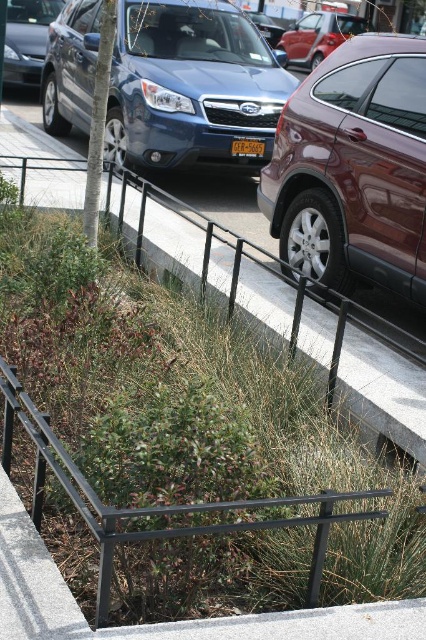
Is point (170, 17) positioned behind point (28, 81)?

That is False.

This screenshot has width=426, height=640. Identify the location of matte blue car at center. (192, 86).

What are the coordinates of `matte blue car at center` in the screenshot? It's located at (192, 86).

Can you confirm if shiny maroon suv at center is shorter than shiny metallic sedan at upper left?

Correct, shiny maroon suv at center is not as tall as shiny metallic sedan at upper left.

Who is higher up, shiny maroon suv at center or shiny metallic sedan at upper left?

shiny metallic sedan at upper left is higher up.

Does point (261, 184) come farther from viewer compared to point (17, 77)?

No, it is in front of (17, 77).

Locate an element on the screen. shiny maroon suv at center is located at coordinates (354, 168).

Which is above, matte blue car at center or metallic red car at center?

metallic red car at center is higher up.

Can you confirm if matte blue car at center is positioned to the right of metallic red car at center?

Incorrect, matte blue car at center is not on the right side of metallic red car at center.

The height and width of the screenshot is (640, 426). Describe the element at coordinates (192, 86) in the screenshot. I see `matte blue car at center` at that location.

This screenshot has width=426, height=640. Identify the location of matte blue car at center. (192, 86).